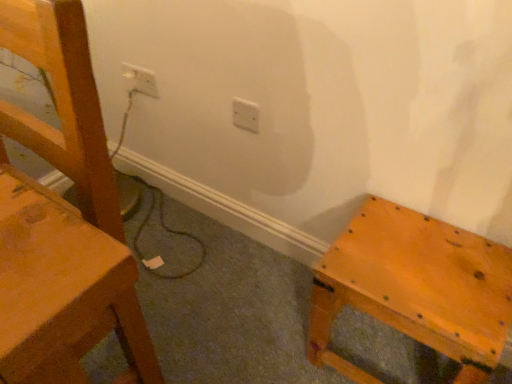
Question: Choose the correct answer: Is matte wood chair at left inside white plastic electric outlet at upper left, placed as the second electric outlet when sorted from bottom to top, or outside it?

Choices:
 (A) outside
 (B) inside

Answer: (A)

Question: From a real-world perspective, is matte wood chair at left above or below white plastic electric outlet at upper left, which ranks as the 2th electric outlet in right-to-left order?

Choices:
 (A) above
 (B) below

Answer: (A)

Question: Which of these objects is positioned farthest from the white plastic electric outlet at center, which appears as the first electric outlet when viewed from the right?

Choices:
 (A) white plastic electric outlet at upper left, arranged as the 1th electric outlet when viewed from the back
 (B) matte wooden stool at lower right
 (C) matte wood chair at left

Answer: (C)

Question: Which is nearer to the white plastic electric outlet at center, which appears as the first electric outlet when viewed from the right?

Choices:
 (A) matte wood chair at left
 (B) matte wooden stool at lower right
 (C) white plastic electric outlet at upper left, placed as the second electric outlet when sorted from bottom to top

Answer: (C)